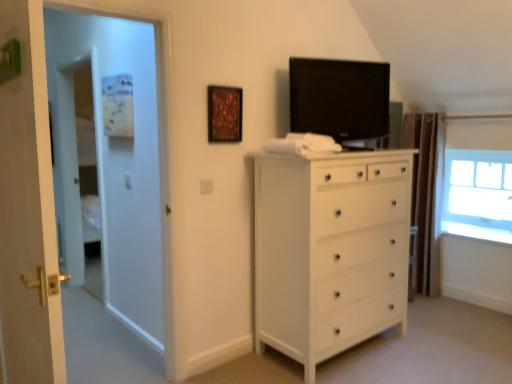
Question: Is white wood chest of drawers at center smaller than brown textured curtain at right?

Choices:
 (A) no
 (B) yes

Answer: (A)

Question: Is white wood chest of drawers at center behind brown textured curtain at right?

Choices:
 (A) yes
 (B) no

Answer: (B)

Question: Is white wood chest of drawers at center positioned beyond the bounds of brown textured curtain at right?

Choices:
 (A) yes
 (B) no

Answer: (A)

Question: Is white wood chest of drawers at center placed right next to brown textured curtain at right?

Choices:
 (A) yes
 (B) no

Answer: (B)

Question: From the image's perspective, is white wood chest of drawers at center on brown textured curtain at right?

Choices:
 (A) no
 (B) yes

Answer: (A)

Question: Considering their positions, is white wood chest of drawers at center located in front of or behind wooden frame at upper center?

Choices:
 (A) behind
 (B) front

Answer: (B)

Question: Visually, is white wood chest of drawers at center positioned to the left or to the right of wooden frame at upper center?

Choices:
 (A) left
 (B) right

Answer: (B)

Question: From the image's perspective, relative to wooden frame at upper center, is white wood chest of drawers at center above or below?

Choices:
 (A) below
 (B) above

Answer: (A)

Question: Considering the positions of white wood chest of drawers at center and wooden frame at upper center in the image, is white wood chest of drawers at center taller or shorter than wooden frame at upper center?

Choices:
 (A) tall
 (B) short

Answer: (A)

Question: From the image's perspective, is white glossy door at left above or below transparent glass window at upper right?

Choices:
 (A) below
 (B) above

Answer: (A)

Question: From their relative heights in the image, would you say white glossy door at left is taller or shorter than transparent glass window at upper right?

Choices:
 (A) tall
 (B) short

Answer: (A)

Question: From a real-world perspective, is white glossy door at left above or below transparent glass window at upper right?

Choices:
 (A) above
 (B) below

Answer: (A)

Question: Is point (159, 51) closer or farther from the camera than point (458, 192)?

Choices:
 (A) farther
 (B) closer

Answer: (B)

Question: From the image's perspective, is white glossy door at left positioned above or below brown textured curtain at right?

Choices:
 (A) below
 (B) above

Answer: (B)

Question: Is white glossy door at left to the left or to the right of brown textured curtain at right in the image?

Choices:
 (A) left
 (B) right

Answer: (A)